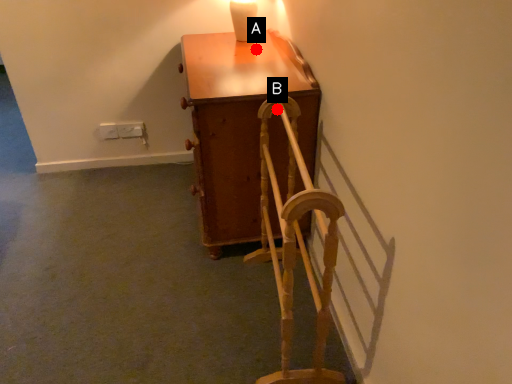
Question: Two points are circled on the image, labeled by A and B beside each circle. Which point is closer to the camera taking this photo?

Choices:
 (A) A is closer
 (B) B is closer

Answer: (B)